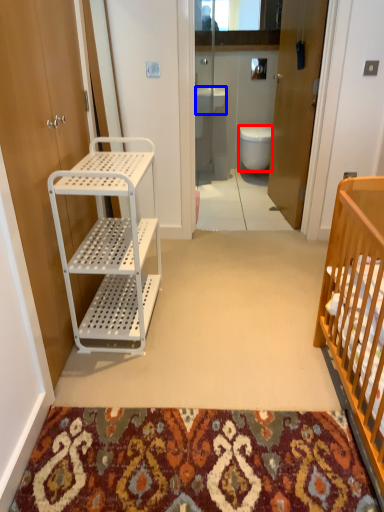
Question: Which object is further to the camera taking this photo, toilet (highlighted by a red box) or sink (highlighted by a blue box)?

Choices:
 (A) toilet
 (B) sink

Answer: (A)